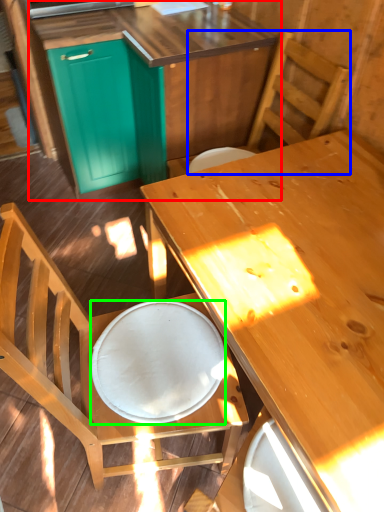
Question: Based on their relative distances, which object is farther from cabinetry (highlighted by a red box)? Choose from chair (highlighted by a blue box) and plate (highlighted by a green box).

Choices:
 (A) chair
 (B) plate

Answer: (B)